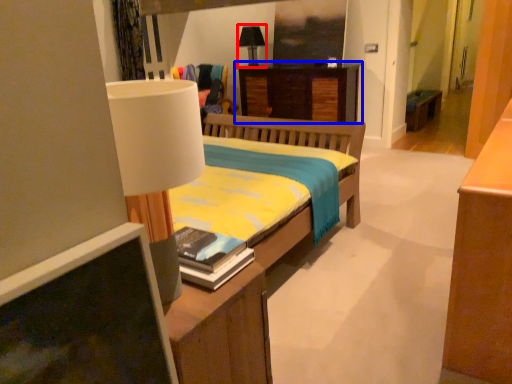
Question: Which object appears closest to the camera in this image, table lamp (highlighted by a red box) or desk (highlighted by a blue box)?

Choices:
 (A) table lamp
 (B) desk

Answer: (B)